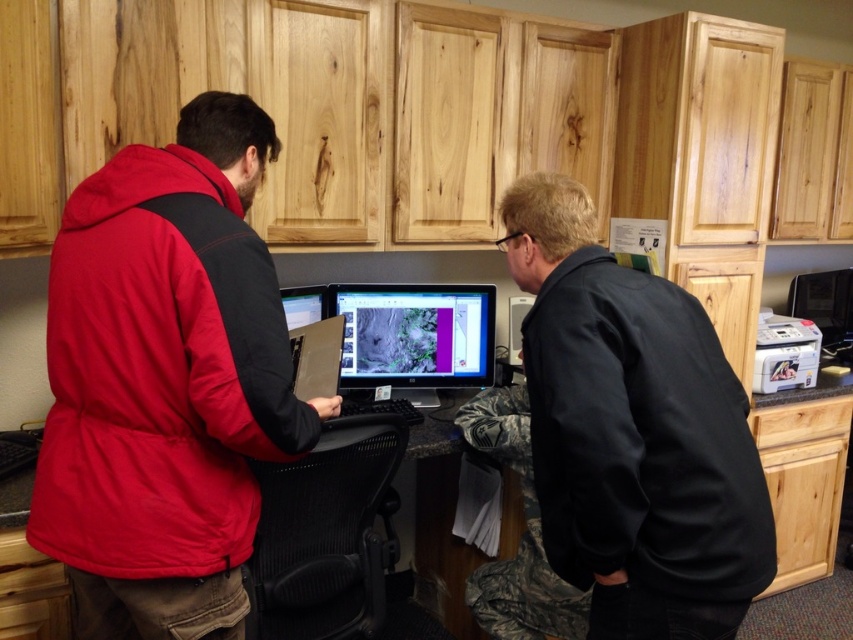
Is point (218, 380) positioned before point (390, 356)?

That is True.

Describe the element at coordinates (160, 372) in the screenshot. I see `matte red jacket at left` at that location.

Identify the location of matte red jacket at left. (160, 372).

How distant is black smooth jacket at lower right from matte black monitor at center?

black smooth jacket at lower right and matte black monitor at center are 1.19 meters apart from each other.

Can you confirm if black smooth jacket at lower right is positioned to the right of matte black monitor at center?

Yes, black smooth jacket at lower right is to the right of matte black monitor at center.

Is point (665, 500) farther from viewer compared to point (474, 336)?

No, (665, 500) is in front of (474, 336).

Image resolution: width=853 pixels, height=640 pixels. I want to click on black smooth jacket at lower right, so click(x=641, y=436).

Is matte red jacket at left positioned behind black smooth jacket at lower right?

That is True.

Can you confirm if matte red jacket at left is wider than black smooth jacket at lower right?

Yes.

Where is `matte red jacket at left`? This screenshot has width=853, height=640. matte red jacket at left is located at coordinates (160, 372).